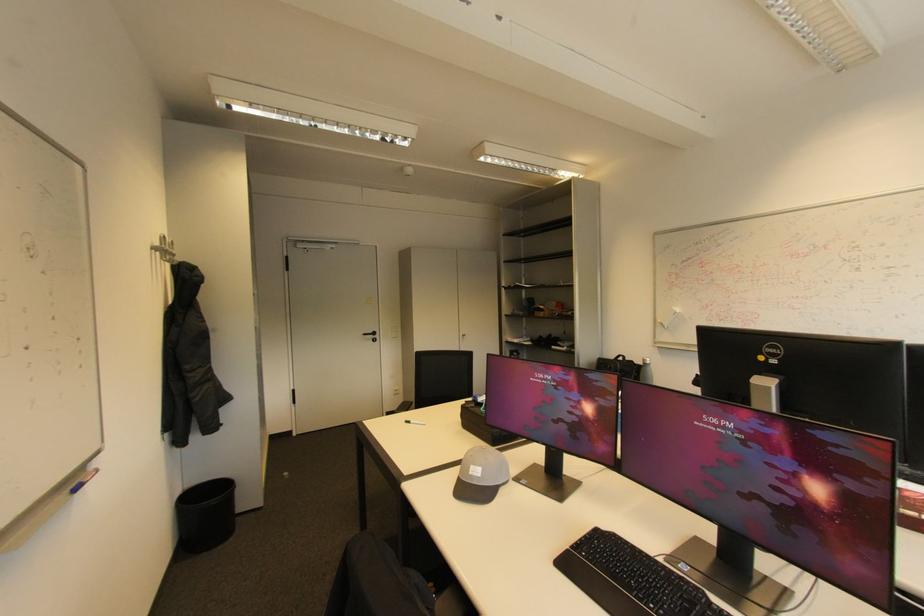
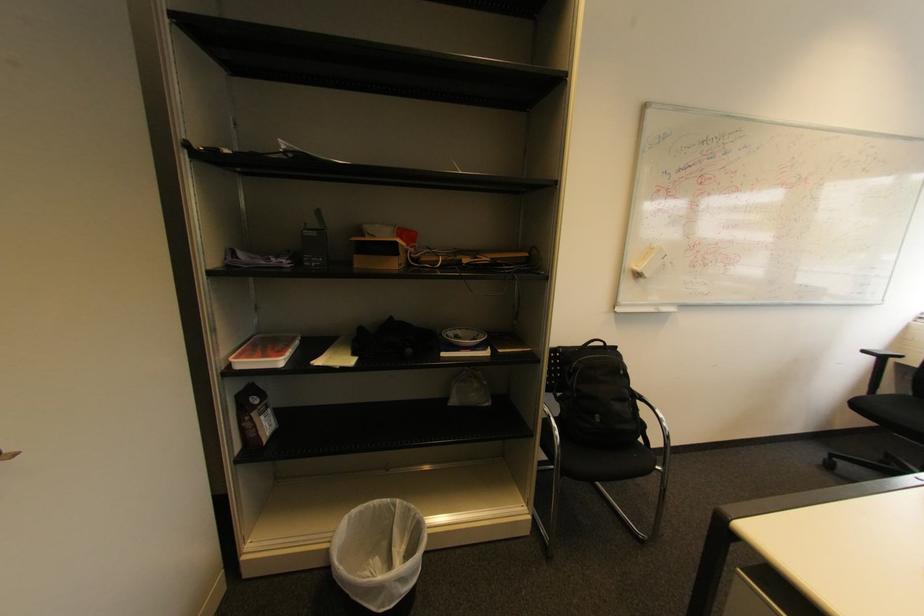
Locate, in the second image, the point that corresponds to pixel 631 360 in the first image.

(613, 345)